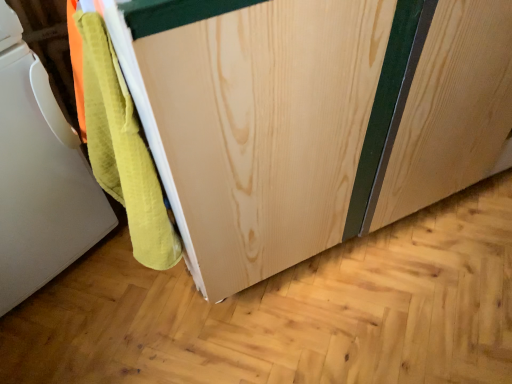
Question: Considering the relative sizes of natural wood cabinet at center and white matte towel at lower left in the image provided, is natural wood cabinet at center bigger than white matte towel at lower left?

Choices:
 (A) yes
 (B) no

Answer: (A)

Question: Can we say natural wood cabinet at center lies outside white matte towel at lower left?

Choices:
 (A) yes
 (B) no

Answer: (A)

Question: Considering the relative positions of natural wood cabinet at center and white matte towel at lower left in the image provided, is natural wood cabinet at center to the right of white matte towel at lower left from the viewer's perspective?

Choices:
 (A) yes
 (B) no

Answer: (A)

Question: Could you tell me if natural wood cabinet at center is facing white matte towel at lower left?

Choices:
 (A) no
 (B) yes

Answer: (A)

Question: From a real-world perspective, is natural wood cabinet at center physically below white matte towel at lower left?

Choices:
 (A) no
 (B) yes

Answer: (B)

Question: Can white matte towel at lower left be found inside natural wood cabinet at center?

Choices:
 (A) no
 (B) yes

Answer: (A)

Question: Is white matte towel at lower left touching natural wood cabinet at center?

Choices:
 (A) yes
 (B) no

Answer: (B)

Question: From the image's perspective, does white matte towel at lower left appear lower than natural wood cabinet at center?

Choices:
 (A) yes
 (B) no

Answer: (A)

Question: Is natural wood cabinet at center completely or partially inside white matte towel at lower left?

Choices:
 (A) no
 (B) yes

Answer: (A)

Question: From a real-world perspective, is white matte towel at lower left below natural wood cabinet at center?

Choices:
 (A) yes
 (B) no

Answer: (B)

Question: Can we say white matte towel at lower left lies outside natural wood cabinet at center?

Choices:
 (A) yes
 (B) no

Answer: (A)

Question: Is white matte towel at lower left thinner than natural wood cabinet at center?

Choices:
 (A) no
 (B) yes

Answer: (B)

Question: From their relative heights in the image, would you say natural wood cabinet at center is taller or shorter than white matte towel at lower left?

Choices:
 (A) short
 (B) tall

Answer: (B)